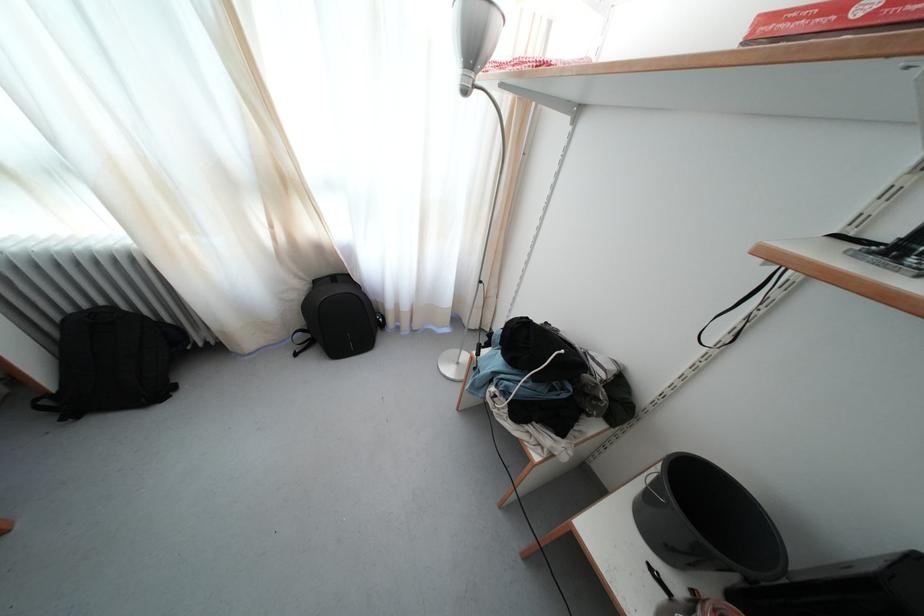
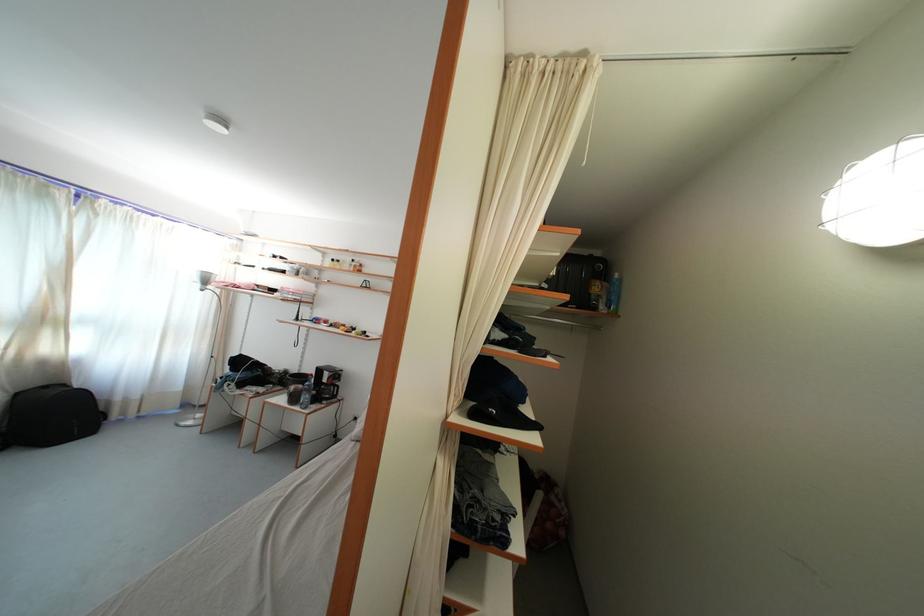
Where in the second image is the point corresponding to the point at 411,313 from the first image?

(141, 403)